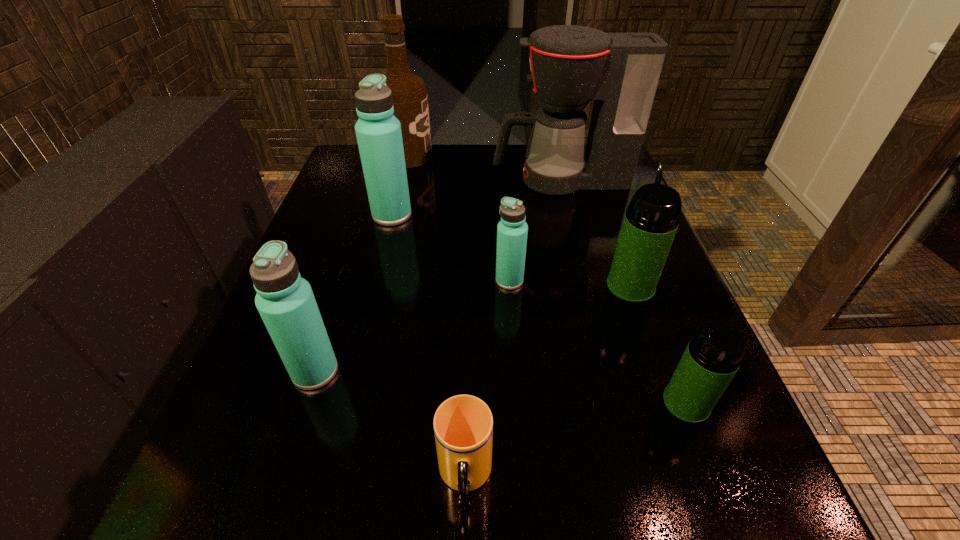
This screenshot has width=960, height=540. Find the location of `object that is positioned at the far right corner`. object that is positioned at the far right corner is located at coordinates (571, 65).

What are the coordinates of `free region at the far edge` in the screenshot? It's located at (407, 171).

Locate an element on the screen. vacant space at the near edge of the desktop is located at coordinates (368, 515).

In the image, there is a desktop. Find the location of `vacant space at the left edge`. vacant space at the left edge is located at coordinates (277, 397).

This screenshot has width=960, height=540. I want to click on free space at the right edge of the desktop, so click(x=640, y=396).

The width and height of the screenshot is (960, 540). Identify the location of vacant space at the far left corner. [x=338, y=184].

In the image, there is a desktop. In order to click on vacant space at the near right corner in this screenshot , I will do `click(727, 492)`.

Identify the location of free area in between the farthest aqua thermos bottle and the fourth object from left to right. The image size is (960, 540). pyautogui.click(x=428, y=346).

Identify the location of free spot between the coffee maker and the third farthest object. The width and height of the screenshot is (960, 540). (476, 198).

Image resolution: width=960 pixels, height=540 pixels. I want to click on empty space between the coffee maker and the alcohol, so [x=484, y=168].